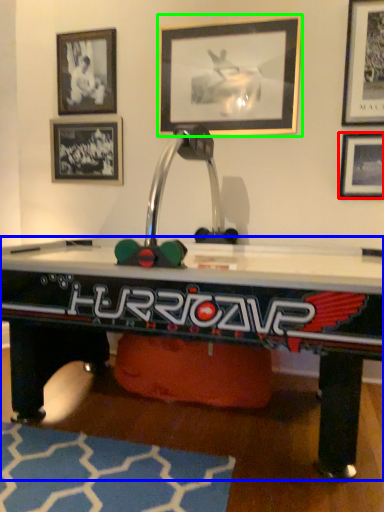
Question: Which object is positioned farthest from picture frame (highlighted by a red box)? Select from table (highlighted by a blue box) and picture frame (highlighted by a green box).

Choices:
 (A) table
 (B) picture frame

Answer: (A)